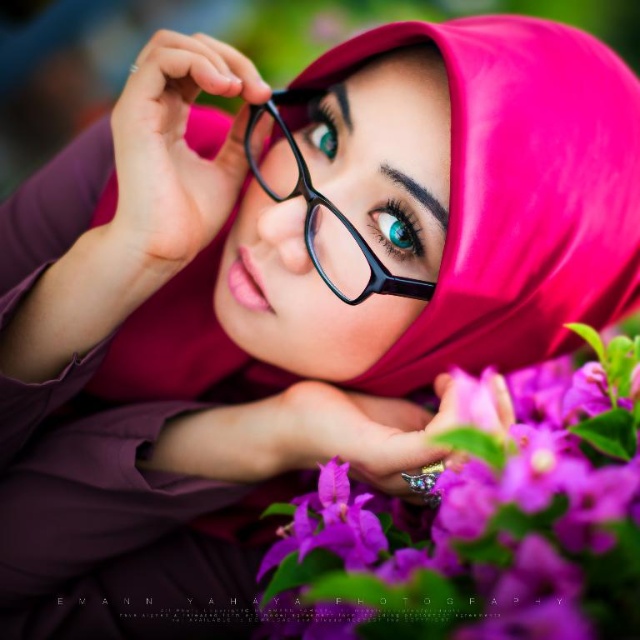
In the scene shown: Which is more to the left, black plastic glasses at center or teal contact lens at center?

From the viewer's perspective, black plastic glasses at center appears more on the left side.

Which is in front, point (305, 188) or point (380, 230)?

Point (305, 188) is in front.

Image resolution: width=640 pixels, height=640 pixels. Find the location of `black plastic glasses at center`. black plastic glasses at center is located at coordinates (316, 202).

Which is more to the left, purple matte flower at center or black plastic glasses at center?

From the viewer's perspective, black plastic glasses at center appears more on the left side.

Does point (620, 474) come behind point (358, 280)?

No.

At what (x,y) coordinates should I click in order to perform the action: click on purple matte flower at center. Please return your answer as a coordinate pair (x, y). This screenshot has width=640, height=640. Looking at the image, I should click on (483, 524).

Between teal contact lens at center and teal glossy eye at center, which one has less height?

teal contact lens at center is shorter.

Is point (378, 224) behind point (336, 136)?

No.

What do you see at coordinates (396, 230) in the screenshot? I see `teal contact lens at center` at bounding box center [396, 230].

I want to click on teal contact lens at center, so click(x=396, y=230).